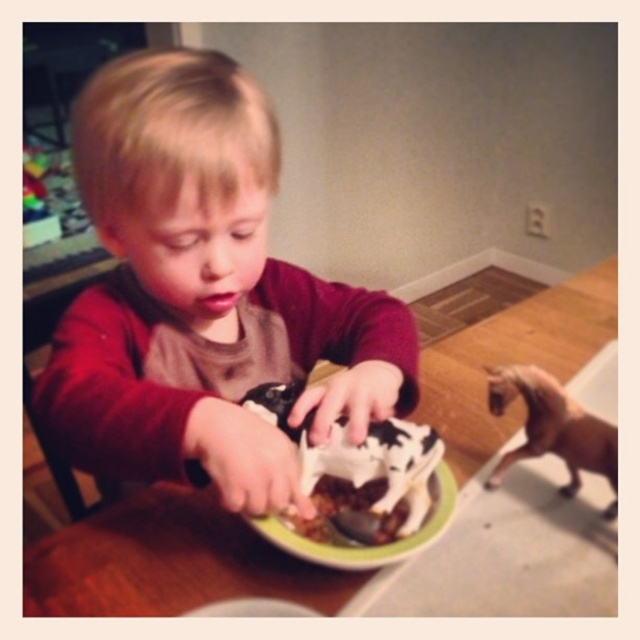
Question: Is matte brown shirt at center closer to camera compared to wooden table at center?

Choices:
 (A) yes
 (B) no

Answer: (A)

Question: Which of these objects is positioned closest to the chocolate frosted cake at center?

Choices:
 (A) wooden table at center
 (B) matte brown shirt at center
 (C) brown matte toy horse at lower right

Answer: (B)

Question: Estimate the real-world distances between objects in this image. Which object is closer to the matte brown shirt at center?

Choices:
 (A) brown matte toy horse at lower right
 (B) chocolate frosted cake at center
 (C) wooden table at center

Answer: (B)

Question: Does wooden table at center appear on the left side of brown matte toy horse at lower right?

Choices:
 (A) yes
 (B) no

Answer: (B)

Question: Is wooden table at center above chocolate frosted cake at center?

Choices:
 (A) no
 (B) yes

Answer: (B)

Question: Which of the following is the farthest from the observer?

Choices:
 (A) matte brown shirt at center
 (B) chocolate frosted cake at center
 (C) wooden table at center
 (D) brown matte toy horse at lower right

Answer: (D)